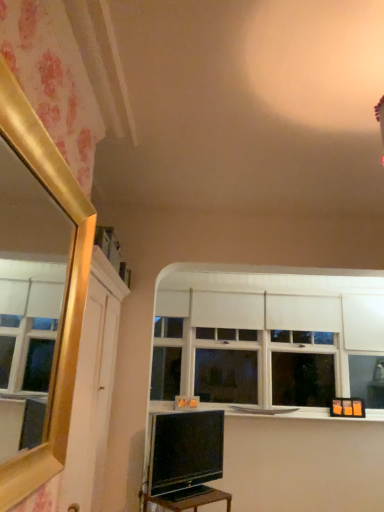
The width and height of the screenshot is (384, 512). In order to click on white matte window at center in this screenshot , I will do `click(268, 340)`.

In order to face black glossy table at lower center, should I rotate leftwards or rightwards?

Rotate your view left by about 0.550°.

Identify the location of white matte window sill at center. The width and height of the screenshot is (384, 512). (304, 413).

Which is closer to the camera, [300,392] or [162,408]?

The point [162,408] is more forward.

From the image's perspective, is white matte window at center positioned above or below white matte window sill at center?

Clearly, from the image's perspective, white matte window at center is above white matte window sill at center.

Is white matte window at center far away from white matte window sill at center?

white matte window at center is near white matte window sill at center, not far away.

Where is `window that appears on the right of white matte window sill at center`? window that appears on the right of white matte window sill at center is located at coordinates (268, 340).

From a real-world perspective, is white matte window at center physically located above or below matte black tv at lower center?

From a real-world perspective, white matte window at center is physically above matte black tv at lower center.

From the image's perspective, is white matte window at center below matte black tv at lower center?

No, from the image's perspective, white matte window at center is not beneath matte black tv at lower center.

Does point (365, 373) appear closer or farther from the camera than point (182, 488)?

Clearly, point (365, 373) is more distant from the camera than point (182, 488).

Does white matte window at center come behind matte black tv at lower center?

Yes, it is.

From the image's perspective, which one is positioned lower, matte black tv at lower center or black glossy table at lower center?

black glossy table at lower center.

Which is more to the right, matte black tv at lower center or black glossy table at lower center?

matte black tv at lower center is more to the right.

Can you confirm if matte black tv at lower center is bigger than black glossy table at lower center?

Yes, matte black tv at lower center is bigger than black glossy table at lower center.

Is matte black tv at lower center closer to camera compared to black glossy table at lower center?

That is False.

Could matte black tv at lower center be considered to be inside black glossy table at lower center?

No, matte black tv at lower center is not surrounded by black glossy table at lower center.

From a real-world perspective, is black glossy table at lower center above or below matte black tv at lower center?

In terms of real-world spatial position, black glossy table at lower center is below matte black tv at lower center.

Are black glossy table at lower center and matte black tv at lower center far apart?

No.

The width and height of the screenshot is (384, 512). I want to click on table in front of the matte black tv at lower center, so click(187, 499).

Looking at this image, from the image's perspective, which is below, matte black tv at lower center or white matte window sill at center?

white matte window sill at center is shown below in the image.

Does point (186, 461) come closer to viewer compared to point (286, 410)?

Yes, it is in front of point (286, 410).

From a real-world perspective, which object rests below the other?

matte black tv at lower center is physically lower.

Between white matte window sill at center and black glossy table at lower center, which one appears on the right side from the viewer's perspective?

From the viewer's perspective, white matte window sill at center appears more on the right side.

Which of these two, white matte window sill at center or black glossy table at lower center, stands shorter?

white matte window sill at center.

Which is correct: white matte window sill at center is inside black glossy table at lower center, or outside of it?

white matte window sill at center is located beyond the bounds of black glossy table at lower center.

Which object is more forward, white matte window sill at center or black glossy table at lower center?

black glossy table at lower center.

Find the location of a particular element. window lying above the black glossy table at lower center (from the image's perspective) is located at coordinates (268, 340).

From the picture: From the image's perspective, is white matte window at center on top of black glossy table at lower center?

Yes, from the image's perspective, white matte window at center is over black glossy table at lower center.

From a real-world perspective, which object stands above the other?

white matte window at center.

Does white matte window at center touch black glossy table at lower center?

No.

Locate an element on the screen. Image resolution: width=384 pixels, height=512 pixels. window sill that is below the white matte window at center (from the image's perspective) is located at coordinates (304, 413).

Locate an element on the screen. The height and width of the screenshot is (512, 384). television in front of the white matte window at center is located at coordinates (186, 460).

Looking at the image, which one is located further to white matte window sill at center, white matte window at center or black glossy table at lower center?

black glossy table at lower center.

Based on their spatial positions, is matte black tv at lower center or white matte window at center closer to black glossy table at lower center?

Based on the image, matte black tv at lower center appears to be nearer to black glossy table at lower center.

Which object lies further to the anchor point white matte window at center, black glossy table at lower center or matte black tv at lower center?

black glossy table at lower center lies further to white matte window at center than the other object.

Looking at the image, which one is located closer to white matte window sill at center, matte black tv at lower center or black glossy table at lower center?

Among the two, matte black tv at lower center is located nearer to white matte window sill at center.

When comparing their distances from black glossy table at lower center, does white matte window at center or white matte window sill at center seem further?

The object further to black glossy table at lower center is white matte window at center.

Based on their spatial positions, is white matte window at center or white matte window sill at center closer to matte black tv at lower center?

white matte window sill at center is positioned closer to the anchor matte black tv at lower center.

Which object lies further to the anchor point white matte window sill at center, black glossy table at lower center or white matte window at center?

black glossy table at lower center lies further to white matte window sill at center than the other object.

From the image, which object appears to be farther from white matte window sill at center, black glossy table at lower center or matte black tv at lower center?

The object further to white matte window sill at center is black glossy table at lower center.

Identify the location of television between black glossy table at lower center and white matte window sill at center in the front-back direction. Image resolution: width=384 pixels, height=512 pixels. point(186,460).

What are the coordinates of `television located between black glossy table at lower center and white matte window at center in the depth direction` in the screenshot? It's located at (186, 460).

The width and height of the screenshot is (384, 512). What are the coordinates of `window sill positioned between black glossy table at lower center and white matte window at center from near to far` in the screenshot? It's located at (304, 413).

Find the location of `window sill located between matte black tv at lower center and white matte window at center in the depth direction`. window sill located between matte black tv at lower center and white matte window at center in the depth direction is located at coordinates (304, 413).